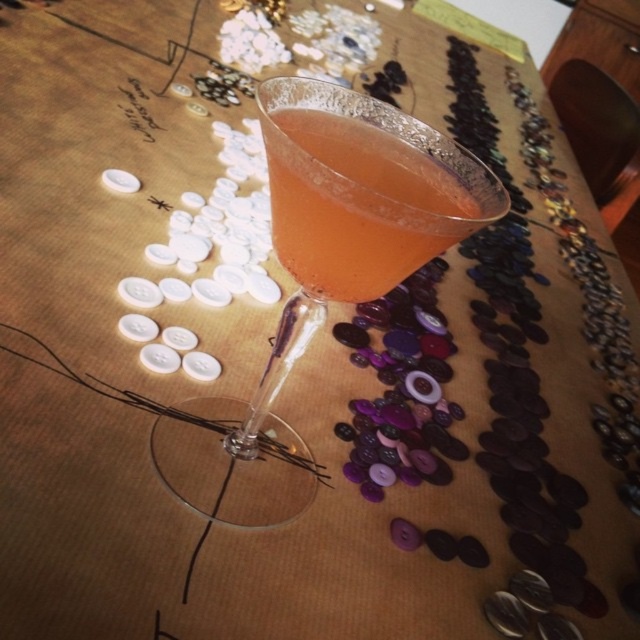
Question: Which point is closer to the camera?

Choices:
 (A) (428, 257)
 (B) (282, 156)

Answer: (B)

Question: Is transparent glass cocktail at center below translucent glass at center?

Choices:
 (A) yes
 (B) no

Answer: (A)

Question: Can you confirm if transparent glass cocktail at center is wider than translucent glass at center?

Choices:
 (A) yes
 (B) no

Answer: (A)

Question: Which object is farther from the camera taking this photo?

Choices:
 (A) transparent glass cocktail at center
 (B) translucent glass at center

Answer: (B)

Question: Can you confirm if transparent glass cocktail at center is positioned below translucent glass at center?

Choices:
 (A) yes
 (B) no

Answer: (A)